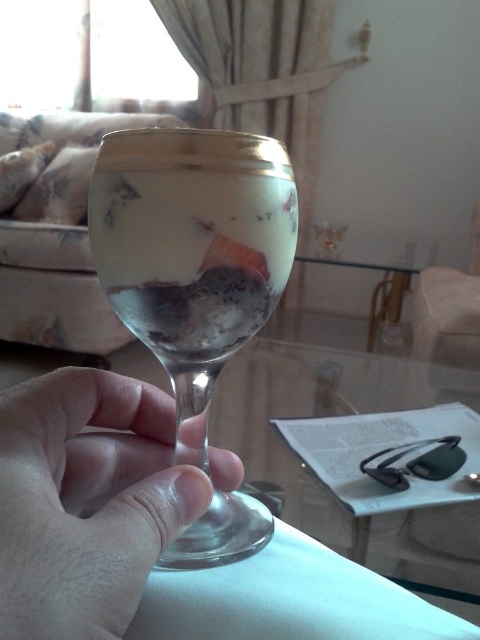
Question: Which of these objects is positioned closest to the transparent glass at lower center?

Choices:
 (A) translucent glass wine at center
 (B) clear glass martini glass at center

Answer: (B)

Question: Which point is closer to the camera?

Choices:
 (A) translucent glass wine at center
 (B) transparent glass at lower center
 (C) clear glass martini glass at center

Answer: (B)

Question: Does clear glass martini glass at center come in front of translucent glass wine at center?

Choices:
 (A) yes
 (B) no

Answer: (A)

Question: Estimate the real-world distances between objects in this image. Which object is farther from the transparent glass at lower center?

Choices:
 (A) translucent glass wine at center
 (B) clear glass martini glass at center

Answer: (A)

Question: Can you confirm if transparent glass at lower center is thinner than translucent glass wine at center?

Choices:
 (A) no
 (B) yes

Answer: (A)

Question: Does clear glass martini glass at center come in front of translucent glass wine at center?

Choices:
 (A) yes
 (B) no

Answer: (A)